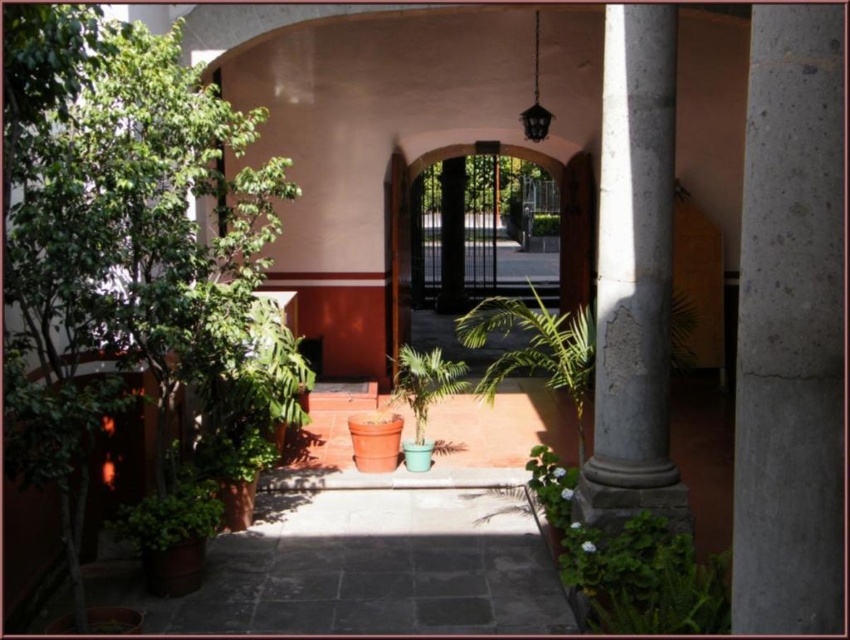
Question: Which object appears closest to the camera in this image?

Choices:
 (A) smooth concrete pillar at center
 (B) gray concrete pillar at center

Answer: (B)

Question: Does brown wooden gate at center have a smaller size compared to green matte plant at center?

Choices:
 (A) yes
 (B) no

Answer: (B)

Question: Does smooth concrete pillar at center have a smaller size compared to green matte plant at center?

Choices:
 (A) yes
 (B) no

Answer: (B)

Question: Which object is farther from the camera taking this photo?

Choices:
 (A) green leafy plant at center
 (B) gray concrete pillar at center
 (C) smooth concrete pillar at center

Answer: (A)

Question: Which of these objects is positioned closest to the green leafy plant at center?

Choices:
 (A) green matte plant at center
 (B) smooth concrete pillar at center
 (C) gray concrete pillar at center

Answer: (B)

Question: Can you confirm if gray concrete pillar at center is positioned above green leafy plant at center?

Choices:
 (A) yes
 (B) no

Answer: (A)